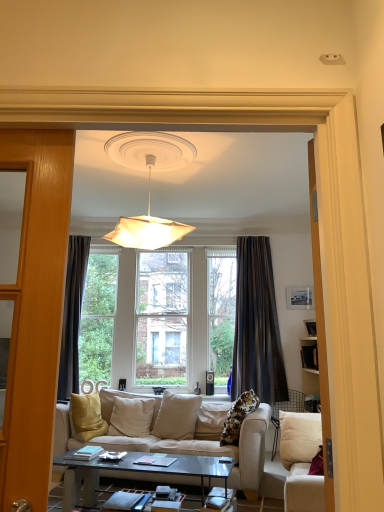
Question: Does point (253, 477) appear closer or farther from the camera than point (127, 217)?

Choices:
 (A) farther
 (B) closer

Answer: (B)

Question: Considering the relative positions of beige fabric couch at center, which is the 1th studio couch in back-to-front order, and white paper lampshade at upper center in the image provided, is beige fabric couch at center, which is the 1th studio couch in back-to-front order, to the left or to the right of white paper lampshade at upper center?

Choices:
 (A) left
 (B) right

Answer: (B)

Question: Based on their relative distances, which object is nearer to the white paper lampshade at upper center?

Choices:
 (A) beige fabric couch at center, which is the 1th studio couch in back-to-front order
 (B) matte black picture frame at upper right
 (C) white fabric studio couch at lower right, the second studio couch when ordered from back to front
 (D) dark gray textured curtain at center
 (E) glassy black coffee table at center

Answer: (A)

Question: Which is nearer to the white fabric studio couch at lower right, the second studio couch when ordered from back to front?

Choices:
 (A) matte black picture frame at upper right
 (B) white paper lampshade at upper center
 (C) glassy black coffee table at center
 (D) beige fabric couch at center, which is the 1th studio couch in back-to-front order
 (E) dark gray textured curtain at center

Answer: (D)